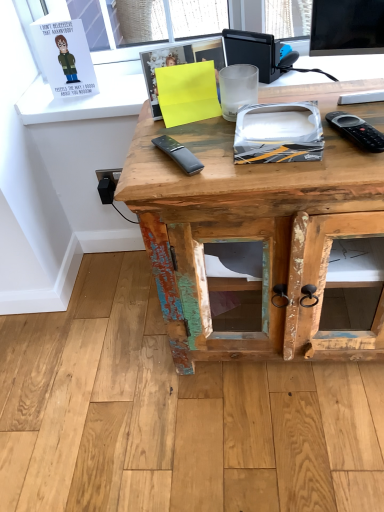
What is the approximate height of rustic wood desk at center?

rustic wood desk at center is 25.79 inches in height.

At what (x,y) coordinates should I click in order to perform the action: click on matte paper card at upper left, positioned as the 1th book in back-to-front order. Please return your answer as a coordinate pair (x, y). The width and height of the screenshot is (384, 512). Looking at the image, I should click on (65, 56).

Locate an element on the screen. The height and width of the screenshot is (512, 384). rustic wood desk at center is located at coordinates (251, 237).

Does point (202, 41) appear closer or farther from the camera than point (76, 75)?

Point (202, 41).

Does yellow paper at center, which ranks as the 1th book in right-to-left order, lie behind matte paper card at upper left, placed as the second book when sorted from right to left?

No.

From a real-world perspective, who is located lower, yellow paper at center, positioned as the second book in top-to-bottom order, or matte paper card at upper left, the 1th book from the left?

matte paper card at upper left, the 1th book from the left, is physically lower.

Are yellow paper at center, the second book viewed from the left, and matte paper card at upper left, acting as the second book starting from the front, making contact?

No, yellow paper at center, the second book viewed from the left, is not with matte paper card at upper left, acting as the second book starting from the front.

Is rustic wood desk at center at the back of yellow paper at center, acting as the first book starting from the bottom?

yellow paper at center, acting as the first book starting from the bottom, is not turned away from rustic wood desk at center.

Which of these two, yellow paper at center, positioned as the second book in top-to-bottom order, or rustic wood desk at center, is thinner?

yellow paper at center, positioned as the second book in top-to-bottom order.

From a real-world perspective, is yellow paper at center, the 1th book viewed from the front, on rustic wood desk at center?

Yes.

Which of these two, yellow paper at center, the second book viewed from the left, or rustic wood desk at center, stands shorter?

With less height is yellow paper at center, the second book viewed from the left.

Which object is closer to the camera, rustic wood desk at center or matte paper card at upper left, the 1th book from the left?

Positioned in front is rustic wood desk at center.

From a real-world perspective, between rustic wood desk at center and matte paper card at upper left, positioned as the 1th book in back-to-front order, who is vertically lower?

From a 3D spatial view, rustic wood desk at center is below.

Between rustic wood desk at center and matte paper card at upper left, positioned as the 1th book in back-to-front order, which one has larger width?

With larger width is rustic wood desk at center.

In the scene shown: Can you confirm if rustic wood desk at center is smaller than matte paper card at upper left, which is counted as the 1th book, starting from the top?

No.

Which of these two, matte paper card at upper left, positioned as the 1th book in back-to-front order, or yellow paper at center, the second book viewed from the left, is smaller?

yellow paper at center, the second book viewed from the left, is smaller.

Which object is closer to the camera taking this photo, matte paper card at upper left, acting as the second book starting from the front, or yellow paper at center, the second book viewed from the left?

yellow paper at center, the second book viewed from the left, is closer to the camera.

Which object is positioned more to the right, matte paper card at upper left, positioned as the 1th book in back-to-front order, or yellow paper at center, the 1th book viewed from the front?

yellow paper at center, the 1th book viewed from the front.

From a real-world perspective, which object stands above the other?

From a 3D spatial view, matte paper card at upper left, which is counted as the 1th book, starting from the top, is above.

Is matte paper card at upper left, positioned as the 1th book in back-to-front order, oriented towards rustic wood desk at center?

No, matte paper card at upper left, positioned as the 1th book in back-to-front order, does not turn towards rustic wood desk at center.

Is rustic wood desk at center completely or partially inside matte paper card at upper left, positioned as the 1th book in back-to-front order?

That's incorrect, rustic wood desk at center is not inside matte paper card at upper left, positioned as the 1th book in back-to-front order.

From the picture: Can you tell me how much rustic wood desk at center and yellow paper at center, arranged as the second book when viewed from the back, differ in facing direction?

17.9 degrees.

In the scene shown: Which object is positioned more to the left, rustic wood desk at center or yellow paper at center, which ranks as the 1th book in right-to-left order?

yellow paper at center, which ranks as the 1th book in right-to-left order, is more to the left.

Considering the positions of objects rustic wood desk at center and yellow paper at center, the second book viewed from the left, in the image provided, who is in front, rustic wood desk at center or yellow paper at center, the second book viewed from the left,?

Positioned in front is rustic wood desk at center.

Based on the photo, from a real-world perspective, is rustic wood desk at center on top of yellow paper at center, the second book viewed from the left?

No.

Find the location of `book located below the matte paper card at upper left, acting as the second book starting from the front (from the image's perspective)`. book located below the matte paper card at upper left, acting as the second book starting from the front (from the image's perspective) is located at coordinates (180, 64).

Image resolution: width=384 pixels, height=512 pixels. Identify the location of desk below the yellow paper at center, arranged as the second book when viewed from the back (from a real-world perspective). (251, 237).

Considering their positions, is rustic wood desk at center positioned closer to yellow paper at center, acting as the first book starting from the bottom, than matte paper card at upper left, the 1th book from the left?

rustic wood desk at center lies closer to yellow paper at center, acting as the first book starting from the bottom, than the other object.

When comparing their distances from rustic wood desk at center, does matte paper card at upper left, the 1th book from the left, or yellow paper at center, acting as the first book starting from the bottom, seem closer?

yellow paper at center, acting as the first book starting from the bottom.

When comparing their distances from rustic wood desk at center, does yellow paper at center, which ranks as the 1th book in right-to-left order, or matte paper card at upper left, the 1th book from the left, seem further?

matte paper card at upper left, the 1th book from the left.

Looking at the image, which one is located closer to matte paper card at upper left, which is counted as the 1th book, starting from the top, rustic wood desk at center or yellow paper at center, the second book viewed from the left?

yellow paper at center, the second book viewed from the left, is closer to matte paper card at upper left, which is counted as the 1th book, starting from the top.

Based on their spatial positions, is yellow paper at center, positioned as the second book in top-to-bottom order, or rustic wood desk at center further from matte paper card at upper left, which ranks as the second book in bottom-to-top order?

rustic wood desk at center.

Which object lies nearer to the anchor point yellow paper at center, positioned as the second book in top-to-bottom order, matte paper card at upper left, which is counted as the 1th book, starting from the top, or rustic wood desk at center?

The object closer to yellow paper at center, positioned as the second book in top-to-bottom order, is rustic wood desk at center.

Where is `book situated between matte paper card at upper left, which is counted as the 1th book, starting from the top, and rustic wood desk at center from left to right`? This screenshot has width=384, height=512. book situated between matte paper card at upper left, which is counted as the 1th book, starting from the top, and rustic wood desk at center from left to right is located at coordinates (180, 64).